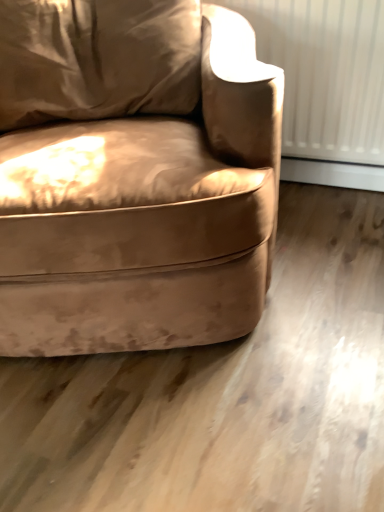
This screenshot has width=384, height=512. What are the coordinates of `suede-like beige couch at center` in the screenshot? It's located at (134, 176).

What do you see at coordinates (134, 176) in the screenshot? I see `suede-like beige couch at center` at bounding box center [134, 176].

At what (x,y) coordinates should I click in order to perform the action: click on suede-like beige couch at center. Please return your answer as a coordinate pair (x, y). The image size is (384, 512). Looking at the image, I should click on (134, 176).